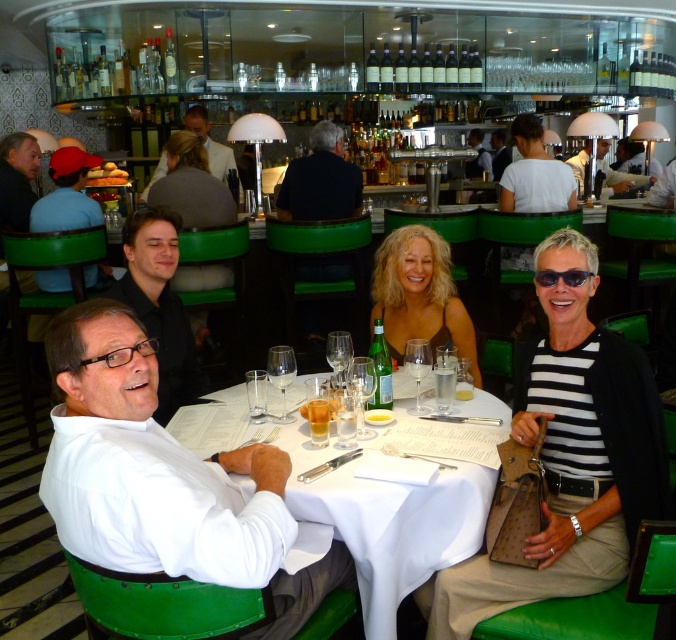
You are a server at the restaurant and need to place a large dessert plate on the table. Considering the size of the white cloth table at center and the light brown leather jacket at upper center, will there be enough space on the table?

The white cloth table at center has a larger size compared to the light brown leather jacket at upper center, so there should be enough space to place the large dessert plate on the table.

You are a photographer standing in front of the table. You need to capture a photo that includes both the black and white striped shirt at center and the matte black jacket at left. Which object should you focus on first to ensure both are in frame?

The black and white striped shirt at center has a greater height compared to the matte black jacket at left, so you should focus on the black and white striped shirt at center first to ensure both are in frame.

You are a waiter in a restaurant and need to deliver a plate to the table. The light brown leather jacket at upper center is blocking your path. Can you reach the white cloth table at center without moving the jacket?

The white cloth table at center is positioned on the right side of the light brown leather jacket at upper center, so you can reach the white cloth table at center by moving around to the right side of the light brown leather jacket at upper center.